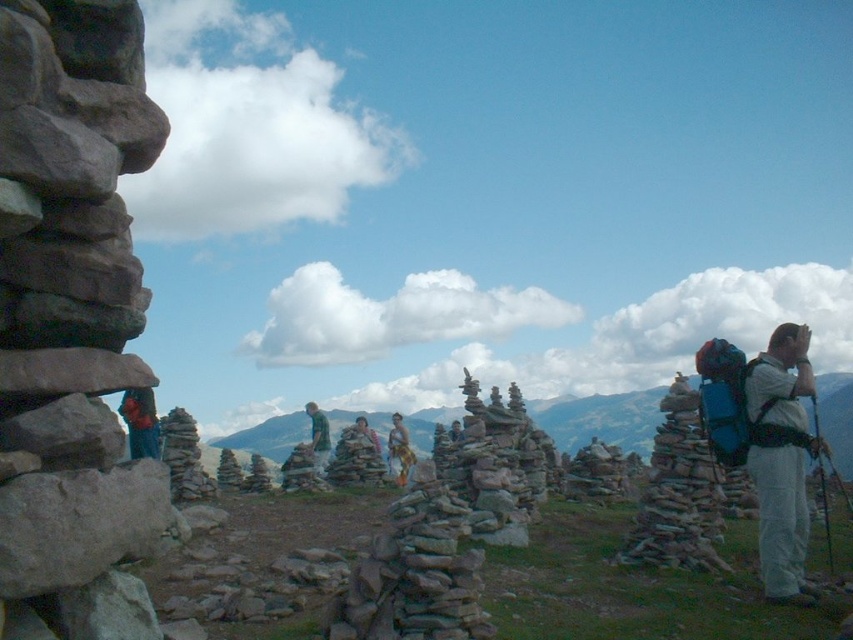
You are standing at the center of the image. Which direction should you walk to reach the gray stone stack at left?

You should walk to the left to reach the gray stone stack at left since it is located at point (73,321), which is to the left of the center.

You are standing in the mountain area and see the gray stone stack at left and the camouflage fabric pants at center. Which object is located to the right of the other?

The gray stone stack at left is to the right of camouflage fabric pants at center.

You are standing at the base of the mountain and want to reach the highest cairn. You notice two points marked on your map as point 1 at coordinates (148,305) and point 2 at (154,416). Which point should you head towards if you want to get closer to the highest cairn?

Point 1 at coordinates (148,305) is closer to the viewer than point 2 at (154,416), so you should head towards point 1 to get closer to the highest cairn.